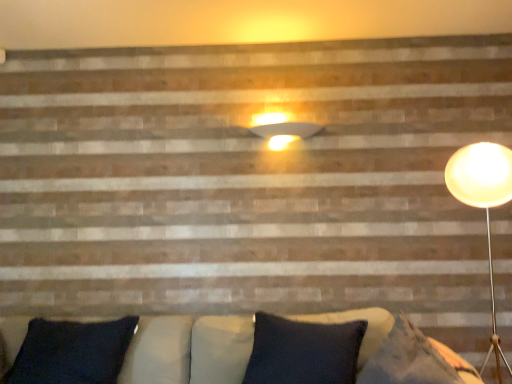
Describe the element at coordinates (72, 352) in the screenshot. I see `dark blue fabric pillow at lower left` at that location.

Measure the distance between point (47, 328) and camera.

They are 2.14 meters apart.

Find the location of `dark blue fabric pillow at lower left`. dark blue fabric pillow at lower left is located at coordinates (x=72, y=352).

The height and width of the screenshot is (384, 512). What do you see at coordinates (285, 133) in the screenshot?
I see `matte white wall sconce at upper center` at bounding box center [285, 133].

The height and width of the screenshot is (384, 512). I want to click on matte white wall sconce at upper center, so click(x=285, y=133).

The width and height of the screenshot is (512, 384). I want to click on dark blue fabric pillow at lower left, so click(x=72, y=352).

Between matte white wall sconce at upper center and dark blue fabric pillow at lower left, which one appears on the right side from the viewer's perspective?

Positioned to the right is matte white wall sconce at upper center.

Does matte white wall sconce at upper center come in front of dark blue fabric pillow at lower left?

That is False.

Which is farther from the camera, (283, 135) or (32, 362)?

The point (283, 135) is farther from the camera.

From the image's perspective, which one is positioned higher, matte white wall sconce at upper center or dark blue fabric pillow at lower left?

matte white wall sconce at upper center is shown above in the image.

From a real-world perspective, is matte white wall sconce at upper center physically located above or below dark blue fabric pillow at lower left?

From a real-world perspective, matte white wall sconce at upper center is physically above dark blue fabric pillow at lower left.

Which of these two, matte white wall sconce at upper center or dark blue fabric pillow at lower left, is wider?

dark blue fabric pillow at lower left.

Considering the relative sizes of matte white wall sconce at upper center and dark blue fabric pillow at lower left in the image provided, is matte white wall sconce at upper center shorter than dark blue fabric pillow at lower left?

Correct, matte white wall sconce at upper center is not as tall as dark blue fabric pillow at lower left.

Does matte white wall sconce at upper center have a larger size compared to dark blue fabric pillow at lower left?

No, matte white wall sconce at upper center is not bigger than dark blue fabric pillow at lower left.

Is matte white wall sconce at upper center positioned beyond the bounds of dark blue fabric pillow at lower left?

matte white wall sconce at upper center lies outside dark blue fabric pillow at lower left's area.

Is matte white wall sconce at upper center far away from dark blue fabric pillow at lower left?

That's right, there is a large distance between matte white wall sconce at upper center and dark blue fabric pillow at lower left.

Could you tell me if matte white wall sconce at upper center is turned towards dark blue fabric pillow at lower left?

No, matte white wall sconce at upper center is not turned towards dark blue fabric pillow at lower left.

How many degrees apart are the facing directions of matte white wall sconce at upper center and dark blue fabric pillow at lower left?

They differ by 0.135 degrees in their facing directions.

Where is `lamp behind the dark blue fabric pillow at lower left`? This screenshot has height=384, width=512. lamp behind the dark blue fabric pillow at lower left is located at coordinates (285, 133).

Based on their positions, is dark blue fabric pillow at lower left located to the left or right of matte white wall sconce at upper center?

dark blue fabric pillow at lower left is positioned on matte white wall sconce at upper center's left side.

Consider the image. Relative to matte white wall sconce at upper center, is dark blue fabric pillow at lower left in front or behind?

Visually, dark blue fabric pillow at lower left is located in front of matte white wall sconce at upper center.

Is point (58, 328) positioned after point (263, 134)?

That is False.

From the image's perspective, which one is positioned lower, dark blue fabric pillow at lower left or matte white wall sconce at upper center?

dark blue fabric pillow at lower left appears lower in the image.

From a real-world perspective, is dark blue fabric pillow at lower left located higher than matte white wall sconce at upper center?

Incorrect, from a real-world perspective, dark blue fabric pillow at lower left is lower than matte white wall sconce at upper center.

Is dark blue fabric pillow at lower left thinner than matte white wall sconce at upper center?

No, dark blue fabric pillow at lower left is not thinner than matte white wall sconce at upper center.

Considering the sizes of objects dark blue fabric pillow at lower left and matte white wall sconce at upper center in the image provided, who is taller, dark blue fabric pillow at lower left or matte white wall sconce at upper center?

dark blue fabric pillow at lower left.

Between dark blue fabric pillow at lower left and matte white wall sconce at upper center, which one has larger size?

dark blue fabric pillow at lower left.

Do you think dark blue fabric pillow at lower left is within matte white wall sconce at upper center, or outside of it?

dark blue fabric pillow at lower left lies outside matte white wall sconce at upper center.

Are dark blue fabric pillow at lower left and matte white wall sconce at upper center far apart?

Indeed, dark blue fabric pillow at lower left is not near matte white wall sconce at upper center.

Is dark blue fabric pillow at lower left facing away from matte white wall sconce at upper center?

dark blue fabric pillow at lower left does not have its back to matte white wall sconce at upper center.

This screenshot has width=512, height=384. Identify the location of pillow below the matte white wall sconce at upper center (from the image's perspective). (72, 352).

At what (x,y) coordinates should I click in order to perform the action: click on lamp above the dark blue fabric pillow at lower left (from a real-world perspective). Please return your answer as a coordinate pair (x, y). The image size is (512, 384). Looking at the image, I should click on (285, 133).

Locate an element on the screen. pillow that is on the left side of matte white wall sconce at upper center is located at coordinates pyautogui.click(x=72, y=352).